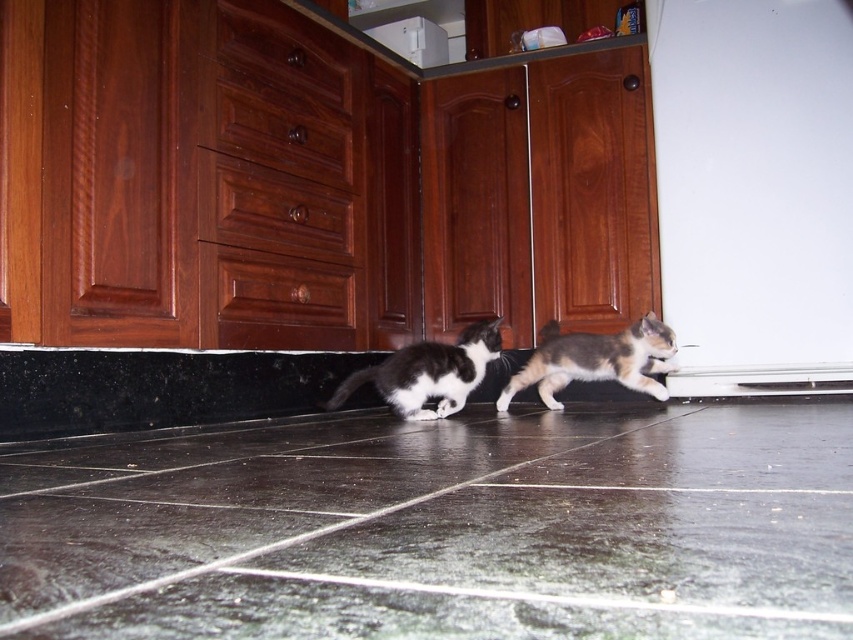
Measure the distance between black tile floor at lower center and camera.

Result: A distance of 14.18 inches exists between black tile floor at lower center and camera.

Can you confirm if black tile floor at lower center is bigger than calico fur cat at center?

Yes.

Identify the location of black tile floor at lower center. (442, 529).

Who is higher up, calico fur cat at center or black and white fur cat at center?

calico fur cat at center is higher up.

Does calico fur cat at center lie in front of black and white fur cat at center?

No, it is behind black and white fur cat at center.

What do you see at coordinates (596, 360) in the screenshot? The height and width of the screenshot is (640, 853). I see `calico fur cat at center` at bounding box center [596, 360].

Where is `calico fur cat at center`? calico fur cat at center is located at coordinates (596, 360).

Who is higher up, black tile floor at lower center or black and white fur cat at center?

black and white fur cat at center is higher up.

Does black tile floor at lower center have a lesser height compared to black and white fur cat at center?

Yes.

Measure the distance between point (483,529) and camera.

Point (483,529) is 24.33 inches from camera.

The height and width of the screenshot is (640, 853). Identify the location of black tile floor at lower center. (442, 529).